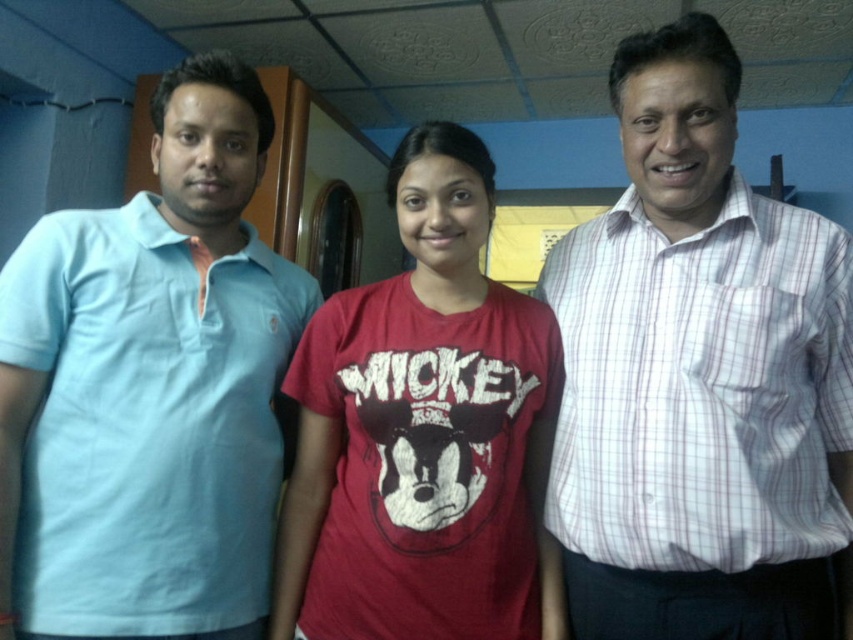
Question: Where is light blue cotton polo shirt at left located in relation to red matte t-shirt at center in the image?

Choices:
 (A) above
 (B) below

Answer: (A)

Question: Which object is closer to the camera taking this photo?

Choices:
 (A) white checkered shirt at right
 (B) light blue cotton polo shirt at left

Answer: (A)

Question: Is light blue cotton polo shirt at left positioned in front of white checkered shirt at right?

Choices:
 (A) yes
 (B) no

Answer: (B)

Question: Which object appears farthest from the camera in this image?

Choices:
 (A) red matte t-shirt at center
 (B) light blue cotton polo shirt at left
 (C) white checkered shirt at right

Answer: (A)

Question: Estimate the real-world distances between objects in this image. Which object is farther from the red matte t-shirt at center?

Choices:
 (A) white checkered shirt at right
 (B) light blue cotton polo shirt at left

Answer: (B)

Question: From the image, what is the correct spatial relationship of light blue cotton polo shirt at left in relation to red matte t-shirt at center?

Choices:
 (A) above
 (B) below

Answer: (A)